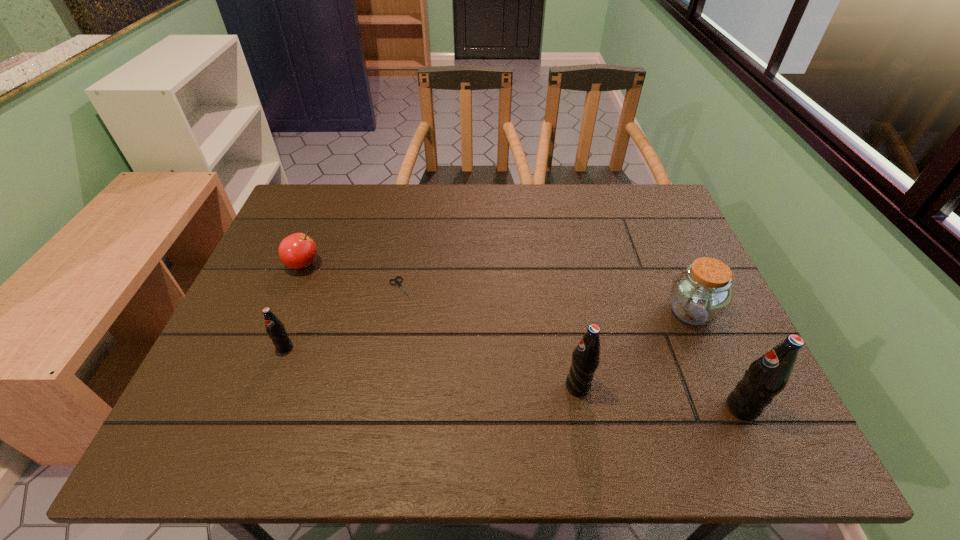
Identify the location of vacant space located on the front label of the second tallest pop. The height and width of the screenshot is (540, 960). (476, 386).

At what (x,y) coordinates should I click in order to perform the action: click on vacant region located 0.270m on the front label of the second tallest pop. Please return your answer as a coordinate pair (x, y). The width and height of the screenshot is (960, 540). Looking at the image, I should click on (439, 386).

I want to click on vacant space positioned on the front label of the rightmost pop, so click(x=536, y=408).

This screenshot has height=540, width=960. In order to click on vacant space situated 0.130m on the front label of the rightmost pop in this screenshot , I will do `click(663, 408)`.

At what (x,y) coordinates should I click in order to perform the action: click on free space located 0.070m on the front label of the rightmost pop. Please return your answer as a coordinate pair (x, y). Looking at the image, I should click on (692, 408).

Where is `vacant area situated 0.270m on the back of the shortest object`? This screenshot has width=960, height=540. vacant area situated 0.270m on the back of the shortest object is located at coordinates (414, 215).

The image size is (960, 540). What are the coordinates of `vacant space located on the back of the apple` in the screenshot? It's located at (335, 188).

Identify the location of blank space located 0.170m on the back of the jar. This screenshot has height=540, width=960. (663, 248).

You are a GUI agent. You are given a task and a screenshot of the screen. Output one action in this format:
    pyautogui.click(x=<x>, y=<y>)
    Task: Click on the pop located in the left edge section of the desktop
    Image resolution: width=960 pixels, height=540 pixels.
    Given the screenshot: What is the action you would take?
    click(275, 329)

Find the location of a particular element. apple located in the left edge section of the desktop is located at coordinates (297, 251).